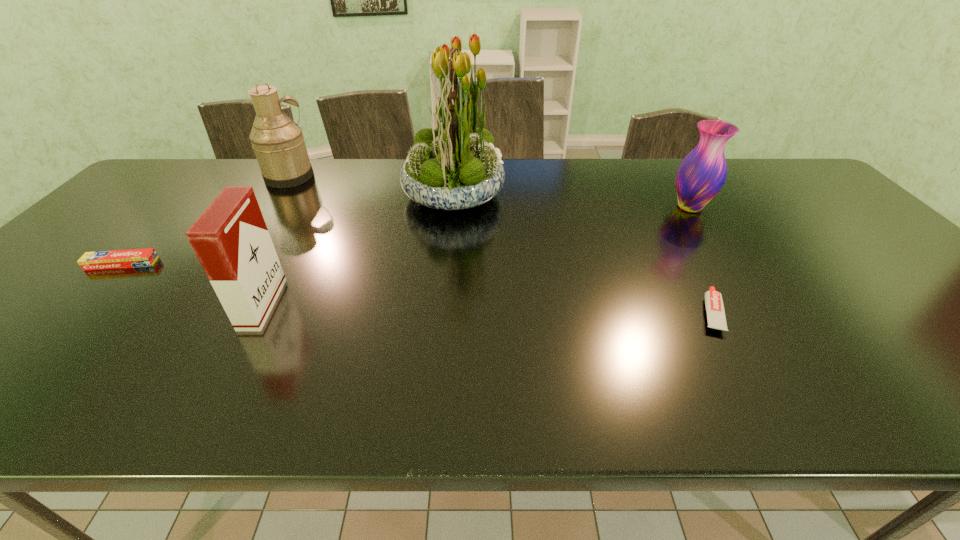
At what (x,y) coordinates should I click in order to perform the action: click on vacant space at the near edge of the desktop. Please return your answer as a coordinate pair (x, y). The image size is (960, 540). Looking at the image, I should click on (810, 392).

In order to click on free space at the left edge of the desktop in this screenshot , I will do `click(53, 323)`.

Where is `free space at the far right corner of the desktop`? free space at the far right corner of the desktop is located at coordinates (802, 177).

Where is `vacant region between the flower arrangement and the nearer toothpaste`? Image resolution: width=960 pixels, height=540 pixels. vacant region between the flower arrangement and the nearer toothpaste is located at coordinates (582, 253).

Image resolution: width=960 pixels, height=540 pixels. Find the location of `blank region between the tallest object and the third object from left to right`. blank region between the tallest object and the third object from left to right is located at coordinates (358, 248).

Find the location of a particular element. free point between the rightmost object and the third object from left to right is located at coordinates (476, 255).

This screenshot has width=960, height=540. Find the location of `free space between the tallest object and the left toothpaste`. free space between the tallest object and the left toothpaste is located at coordinates (288, 228).

Locate an element on the screen. Image resolution: width=960 pixels, height=540 pixels. free spot between the fifth object from right to left and the right toothpaste is located at coordinates (500, 245).

Find the location of a particular element. the third closest object to the rightmost object is located at coordinates point(231,240).

At what (x,y) coordinates should I click in order to perform the action: click on object that is the third nearest to the fifth shortest object. Please return your answer as a coordinate pair (x, y). The width and height of the screenshot is (960, 540). Looking at the image, I should click on (231, 240).